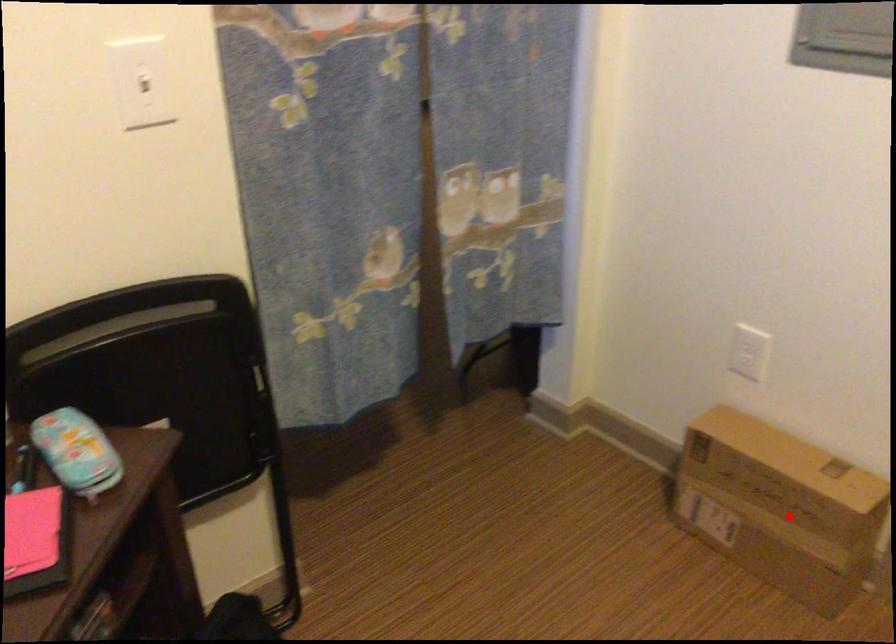
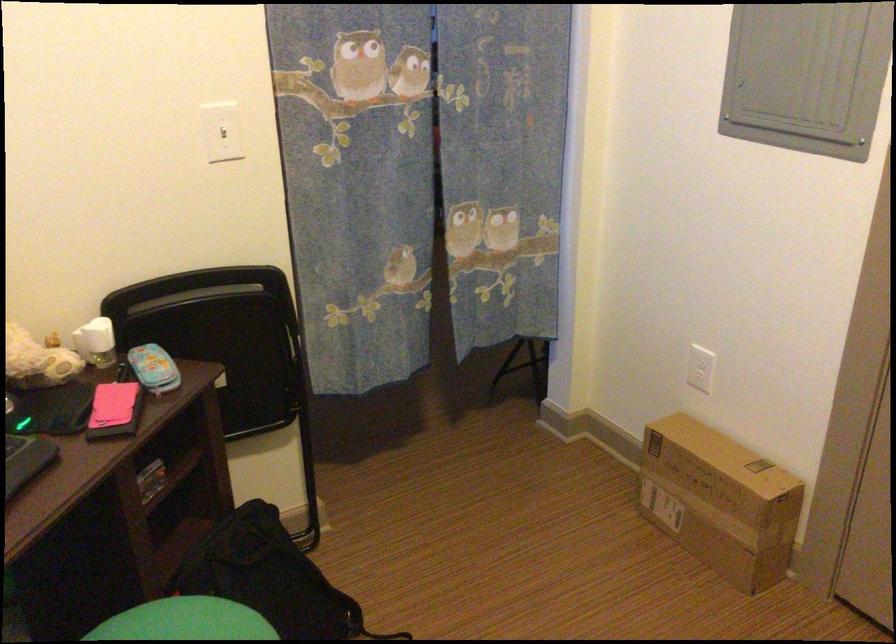
Question: I am providing you with two images of the same scene from different viewpoints. Given a red point in image1, look at the same physical point in image2. Is it:

Choices:
 (A) Closer to the viewpoint
 (B) Farther from the viewpoint

Answer: (B)